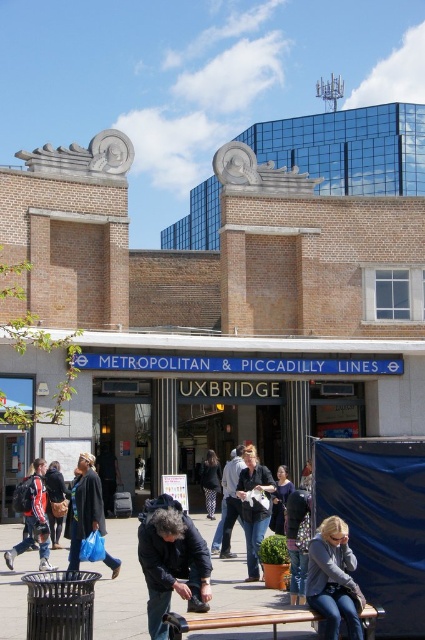
Is point (84, 538) in front of point (260, 465)?

Yes, it is.

Can you confirm if matte black jacket at lower left is positioned to the right of matte black jacket at center?

In fact, matte black jacket at lower left is to the left of matte black jacket at center.

Describe the element at coordinates (84, 508) in the screenshot. The width and height of the screenshot is (425, 640). I see `matte black jacket at lower left` at that location.

Find the location of a particular element. matte black jacket at lower left is located at coordinates (84, 508).

In the scene shown: Who is higher up, smooth concrete bench at lower center or matte black jacket at center?

matte black jacket at center is higher up.

Which is in front, point (176, 611) or point (254, 499)?

Point (176, 611)

Which is behind, point (210, 528) or point (249, 480)?

The point (210, 528) is more distant.

The width and height of the screenshot is (425, 640). I want to click on smooth concrete bench at lower center, so click(x=121, y=588).

Which is more to the right, dark blue jacket at lower center or dark gray sweater at center?

dark gray sweater at center

What do you see at coordinates (172, 564) in the screenshot? I see `dark blue jacket at lower center` at bounding box center [172, 564].

At what (x,y) coordinates should I click in order to perform the action: click on dark blue jacket at lower center. Please return your answer as a coordinate pair (x, y). The image size is (425, 640). Looking at the image, I should click on (172, 564).